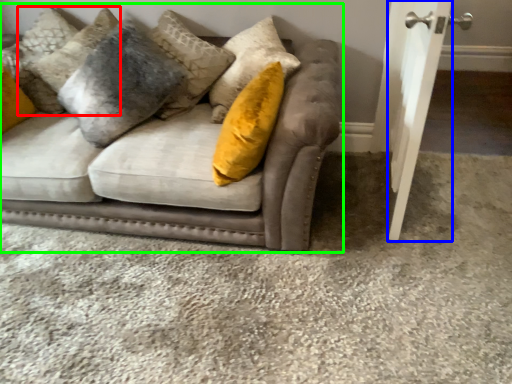
Question: Which is farther away from pillow (highlighted by a red box)? door (highlighted by a blue box) or studio couch (highlighted by a green box)?

Choices:
 (A) door
 (B) studio couch

Answer: (A)